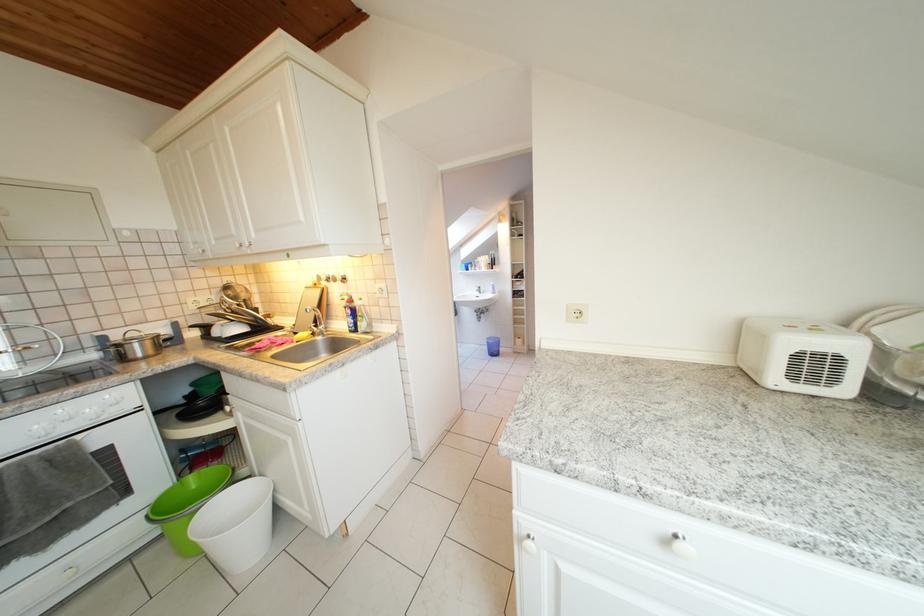
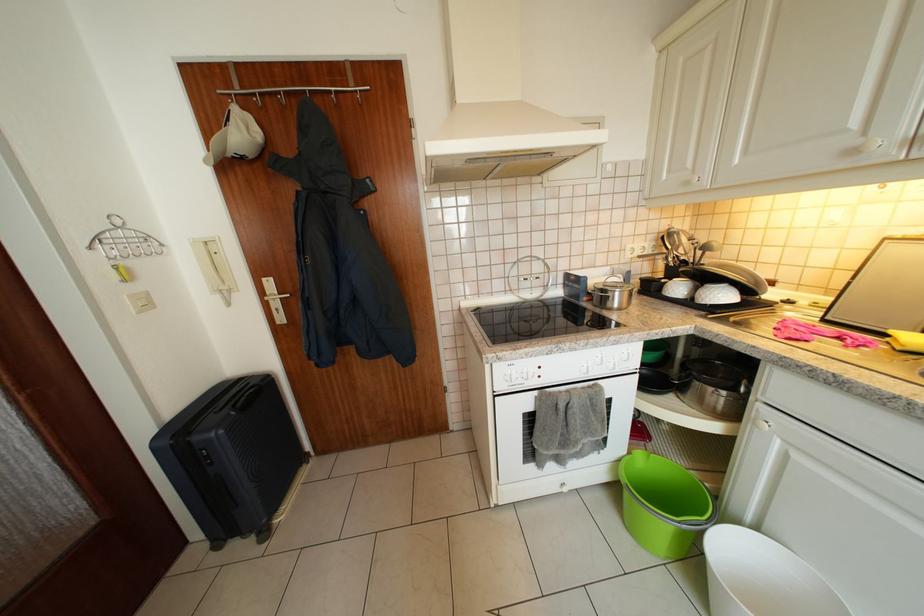
The point at [247,334] is marked in the first image. Where is the corresponding point in the second image?

(730, 300)